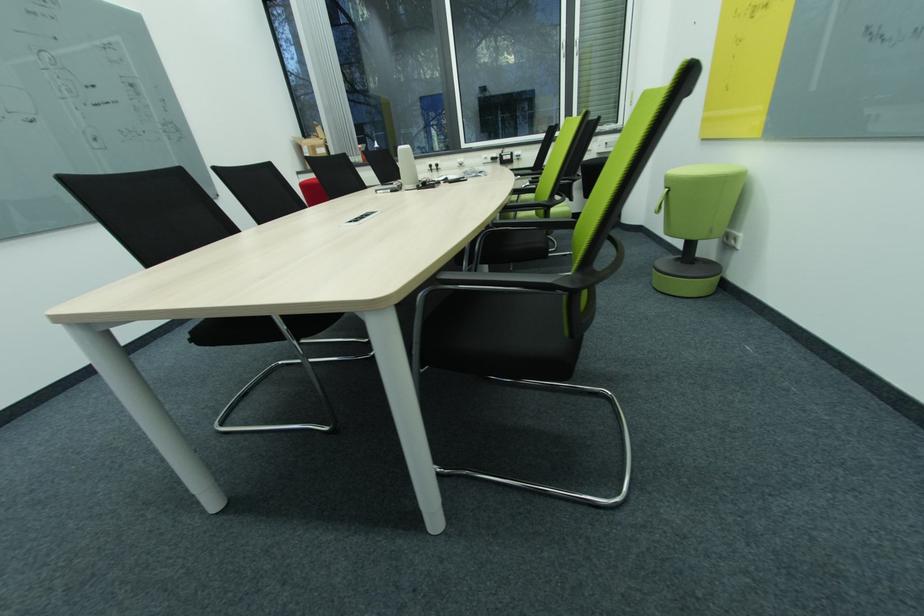
Where would you lift the green stool handle? Please return your answer as a coordinate pair (x, y).

(662, 200)